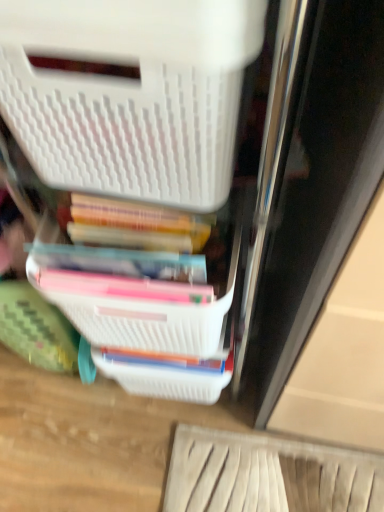
Question: Considering the positions of white plastic storage box at upper left and white plastic basket at center in the image, is white plastic storage box at upper left wider or thinner than white plastic basket at center?

Choices:
 (A) wide
 (B) thin

Answer: (B)

Question: From their relative heights in the image, would you say white plastic storage box at upper left is taller or shorter than white plastic basket at center?

Choices:
 (A) tall
 (B) short

Answer: (A)

Question: Does point (200, 113) appear closer or farther from the camera than point (114, 340)?

Choices:
 (A) farther
 (B) closer

Answer: (B)

Question: Based on their positions, is white plastic basket at center located to the left or right of white plastic storage box at upper left?

Choices:
 (A) right
 (B) left

Answer: (A)

Question: From their relative heights in the image, would you say white plastic basket at center is taller or shorter than white plastic storage box at upper left?

Choices:
 (A) short
 (B) tall

Answer: (A)

Question: Is white plastic basket at center in front of or behind white plastic storage box at upper left in the image?

Choices:
 (A) front
 (B) behind

Answer: (B)

Question: Looking at their shapes, would you say white plastic basket at center is wider or thinner than white plastic storage box at upper left?

Choices:
 (A) wide
 (B) thin

Answer: (A)